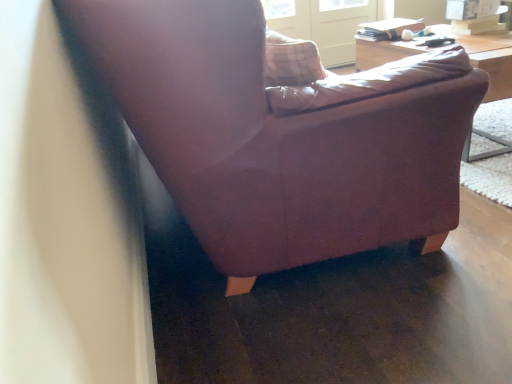
Question: Is wooden table at upper right taller or shorter than clear glass screen door at upper center?

Choices:
 (A) tall
 (B) short

Answer: (B)

Question: Is wooden table at upper right spatially inside clear glass screen door at upper center, or outside of it?

Choices:
 (A) inside
 (B) outside

Answer: (B)

Question: Considering the real-world distances, which object is farthest from the clear glass screen door at upper center?

Choices:
 (A) matte purple armchair at center
 (B) wooden table at upper right

Answer: (A)

Question: Which of these objects is positioned closest to the wooden table at upper right?

Choices:
 (A) matte purple armchair at center
 (B) clear glass screen door at upper center

Answer: (A)